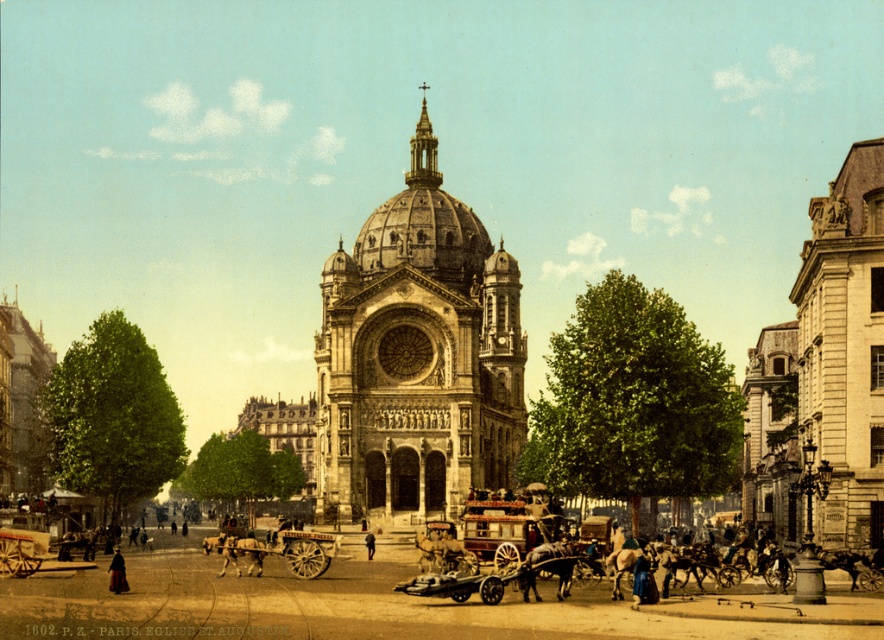
Can you confirm if stone building at right is shorter than wooden cart at lower left?

Incorrect, stone building at right's height does not fall short of wooden cart at lower left's.

Which is in front, point (783, 516) or point (0, 538)?

Point (0, 538) is more forward.

The width and height of the screenshot is (884, 640). What do you see at coordinates (827, 371) in the screenshot?
I see `stone building at right` at bounding box center [827, 371].

Find the location of a particular element. stone building at right is located at coordinates (827, 371).

Is point (404, 401) farther from camera compared to point (5, 545)?

Yes, point (404, 401) is behind point (5, 545).

Consider the image. Who is positioned more to the left, stone church at center or wooden cart at lower left?

wooden cart at lower left

The image size is (884, 640). In order to click on stone church at center in this screenshot , I will do `click(417, 355)`.

Which is behind, point (858, 460) or point (118, 563)?

The point (858, 460) is behind.

Which is in front, point (867, 305) or point (111, 564)?

Point (111, 564) is more forward.

Between point (759, 412) and point (111, 566), which one is positioned behind?

The point (759, 412) is behind.

Image resolution: width=884 pixels, height=640 pixels. I want to click on stone building at right, so click(x=827, y=371).